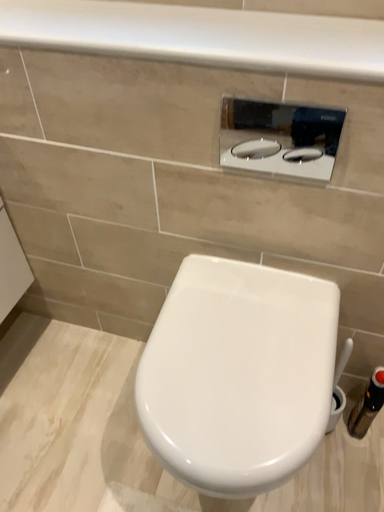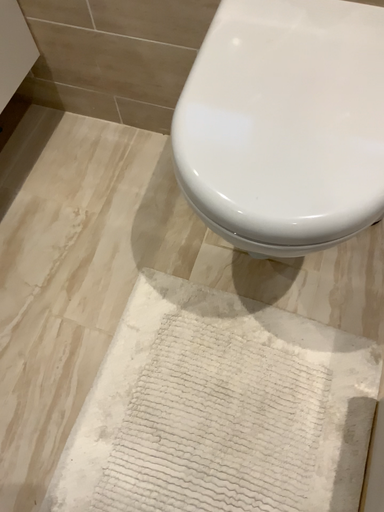
Question: How did the camera likely rotate when shooting the video?

Choices:
 (A) rotated downward
 (B) rotated upward

Answer: (A)